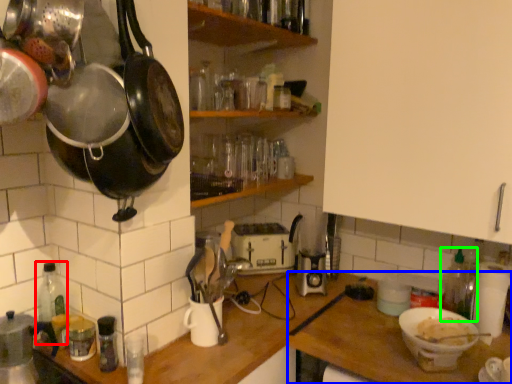
Question: Estimate the real-world distances between objects in this image. Which object is farther from bottle (highlighted by a red box), table (highlighted by a blue box) or bottle (highlighted by a green box)?

Choices:
 (A) table
 (B) bottle

Answer: (B)